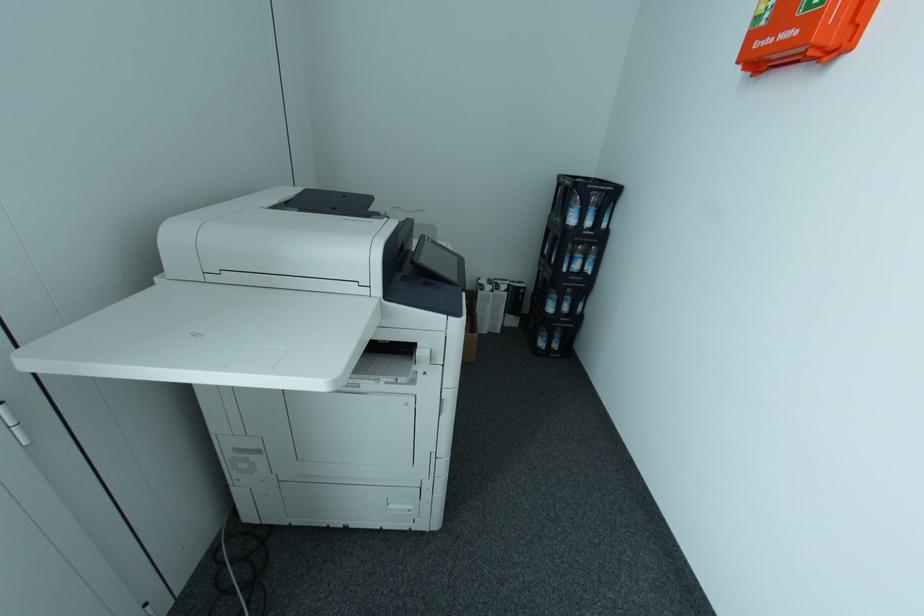
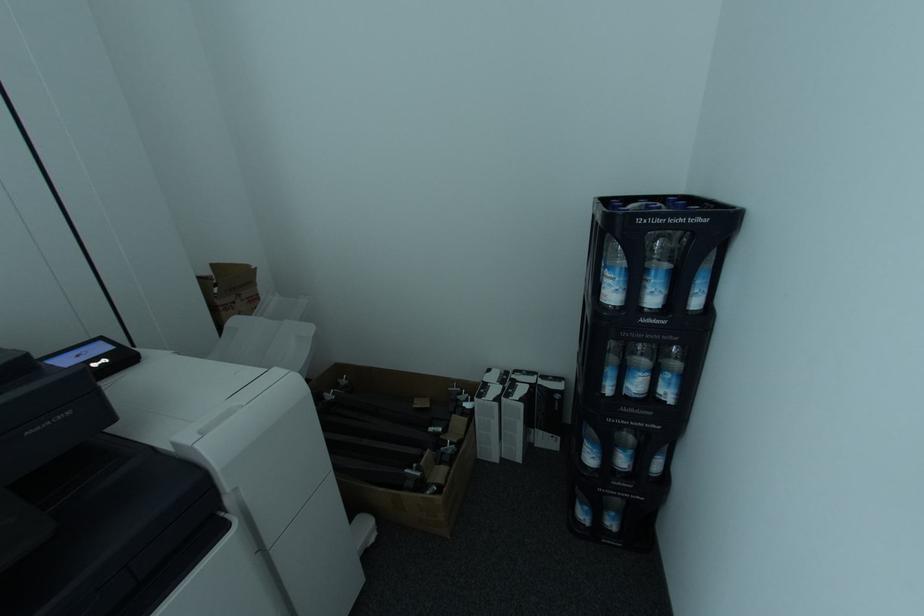
In a continuous first-person perspective shot, in which direction is the camera moving?

The movement direction of the cameraman is right, forward.